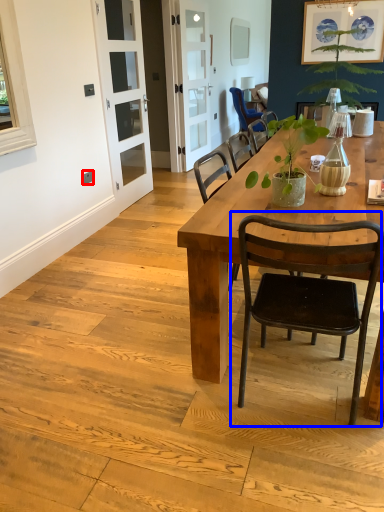
Question: Which of the following is the closest to the observer, power outlet (highlighted by a red box) or chair (highlighted by a blue box)?

Choices:
 (A) power outlet
 (B) chair

Answer: (B)